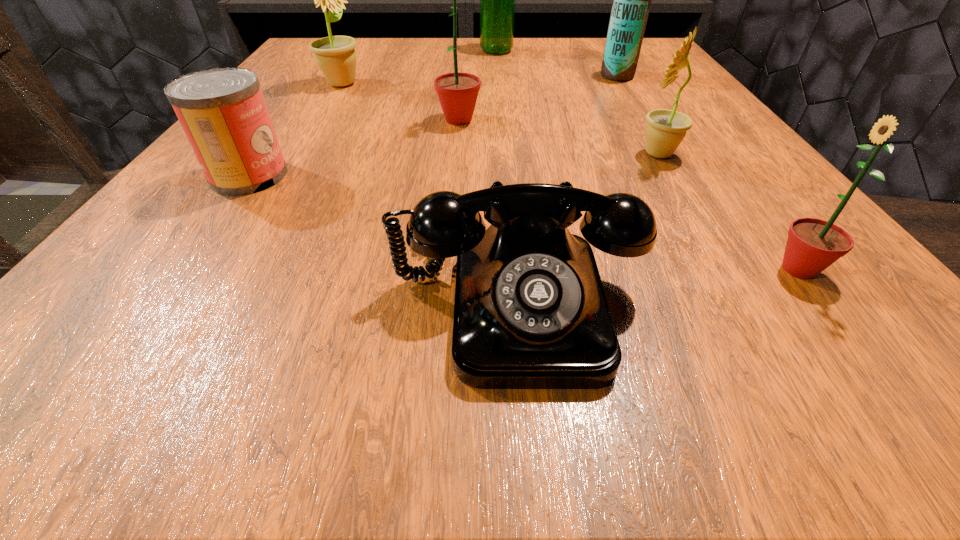
Identify which sunflower is the second closest to the left beer bottle. Please provide its 2D coordinates. Your answer should be formatted as a tuple, i.e. [(x, y)], where the tuple contains the x and y coordinates of a point satisfying the conditions above.

[(457, 92)]

Locate which sunflower ranks in proximity to the farther beer bottle. Please provide its 2D coordinates. Your answer should be formatted as a tuple, i.e. [(x, y)], where the tuple contains the x and y coordinates of a point satisfying the conditions above.

[(335, 55)]